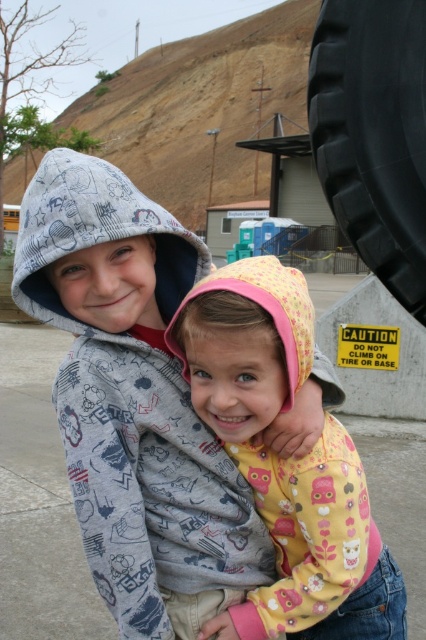
Question: Does yellow fabric hoodie at center have a greater width compared to black rubber tire at upper right?

Choices:
 (A) yes
 (B) no

Answer: (A)

Question: Does gray cotton hoodie at center have a greater width compared to yellow fabric hoodie at center?

Choices:
 (A) no
 (B) yes

Answer: (B)

Question: Which of the following is the closest to the observer?

Choices:
 (A) (339, 444)
 (B) (227, 586)

Answer: (A)

Question: Which of these objects is positioned closest to the yellow fabric hoodie at center?

Choices:
 (A) black rubber tire at upper right
 (B) gray cotton hoodie at center

Answer: (B)

Question: Which of the following is the farthest from the observer?

Choices:
 (A) yellow fabric hoodie at center
 (B) black rubber tire at upper right

Answer: (A)

Question: Does gray cotton hoodie at center have a smaller size compared to black rubber tire at upper right?

Choices:
 (A) no
 (B) yes

Answer: (A)